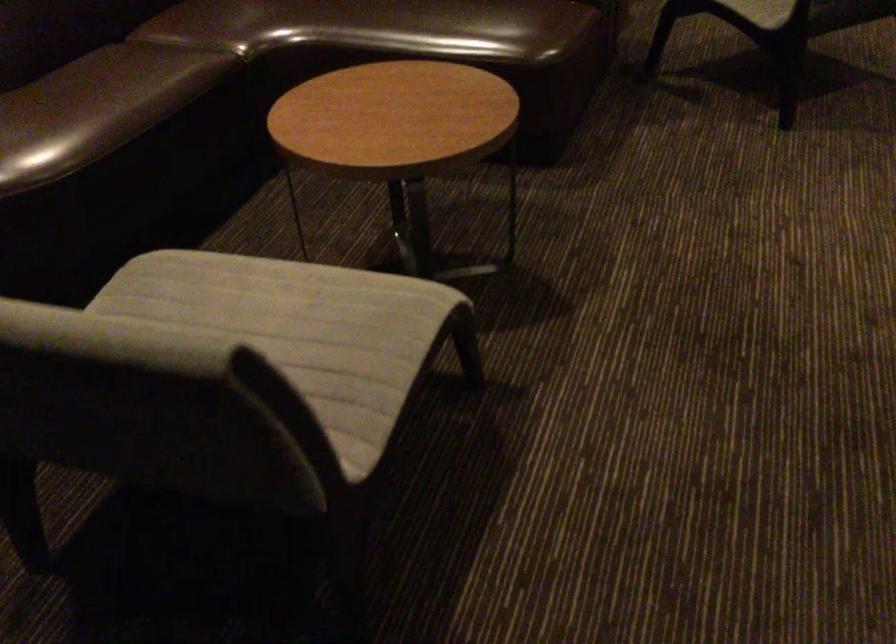
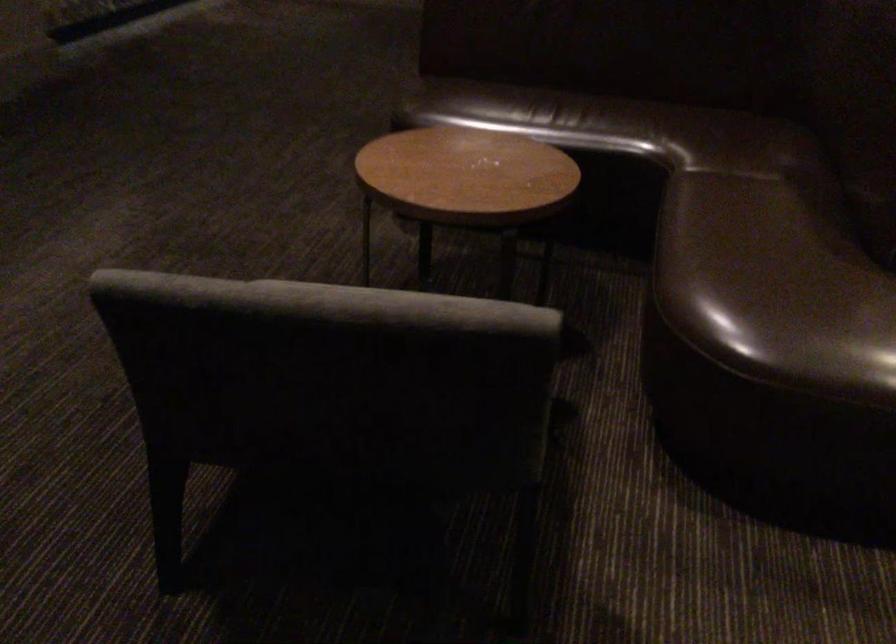
Question: In a continuous first-person perspective shot, in which direction is the camera moving?

Choices:
 (A) Left
 (B) Right
 (C) Forward
 (D) Backward

Answer: (A)